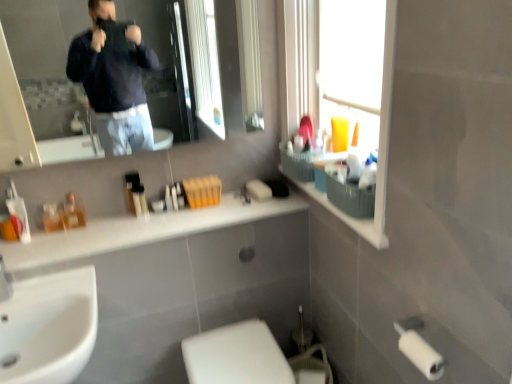
Find the location of a particular element. The width and height of the screenshot is (512, 384). blank area to the left of translucent plastic tubes at center, which is counted as the 1th toiletry, starting from the right is located at coordinates (101, 219).